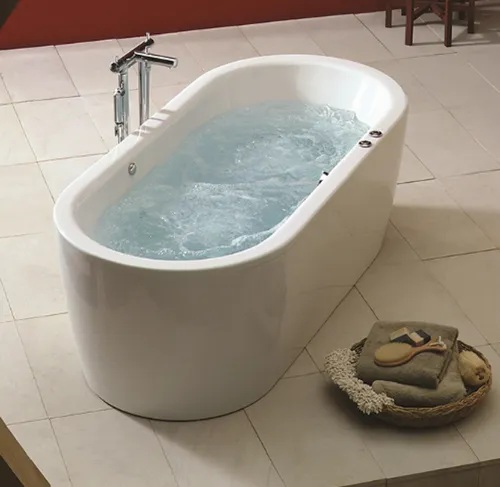
Find the location of a particular element. The height and width of the screenshot is (487, 500). brown stool is located at coordinates (438, 12).